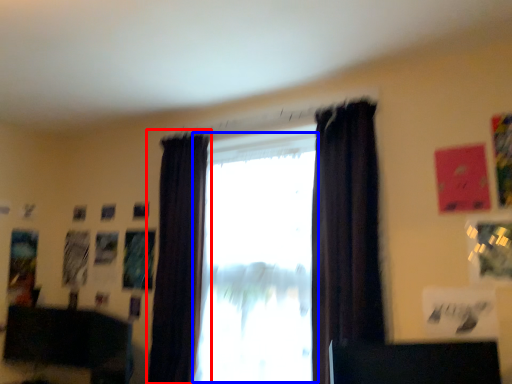
Question: Which object appears closest to the camera in this image, curtain (highlighted by a red box) or window (highlighted by a blue box)?

Choices:
 (A) curtain
 (B) window

Answer: (B)